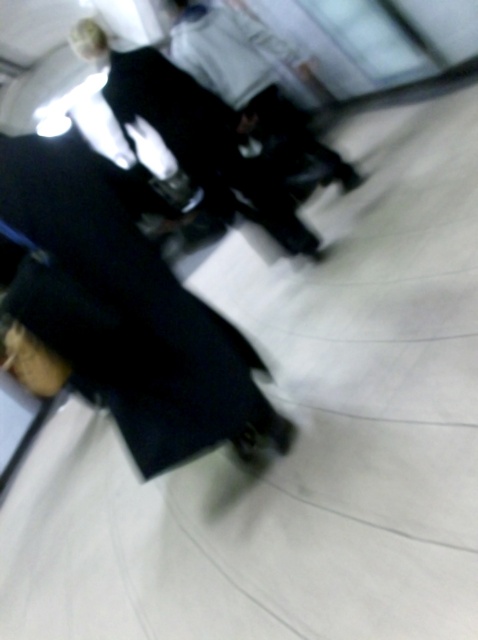
I want to click on black leather jacket at upper center, so click(x=195, y=132).

Who is positioned more to the left, black leather jacket at upper center or dark fabric jacket at center?

black leather jacket at upper center

Identify the location of black leather jacket at upper center. Image resolution: width=478 pixels, height=640 pixels. (195, 132).

Can you confirm if black fabric business suit at lower left is positioned to the left of black leather jacket at upper center?

Correct, you'll find black fabric business suit at lower left to the left of black leather jacket at upper center.

Is point (155, 454) closer to camera compared to point (227, 195)?

Yes, point (155, 454) is closer to viewer.

Measure the distance between point (x=100, y=252) and camera.

Point (x=100, y=252) and camera are 5.33 feet apart.

Where is `black fabric business suit at lower left`? black fabric business suit at lower left is located at coordinates (122, 307).

Between black fabric business suit at lower left and dark fabric jacket at center, which one is positioned higher?

dark fabric jacket at center is above.

This screenshot has width=478, height=640. I want to click on black fabric business suit at lower left, so 122,307.